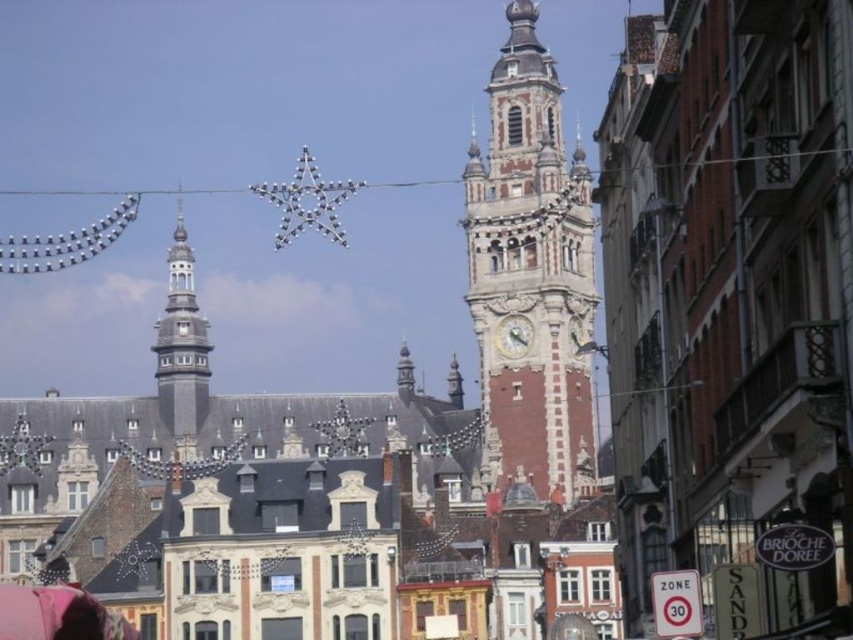
Who is more forward, (486, 372) or (177, 326)?

Positioned in front is point (177, 326).

In the scene shown: Can you confirm if red brick clock tower at center is smaller than gray stone bell tower at left?

Actually, red brick clock tower at center might be larger than gray stone bell tower at left.

Locate an element on the screen. red brick clock tower at center is located at coordinates (531, 276).

This screenshot has width=853, height=640. What are the coordinates of `red brick clock tower at center` in the screenshot? It's located at (531, 276).